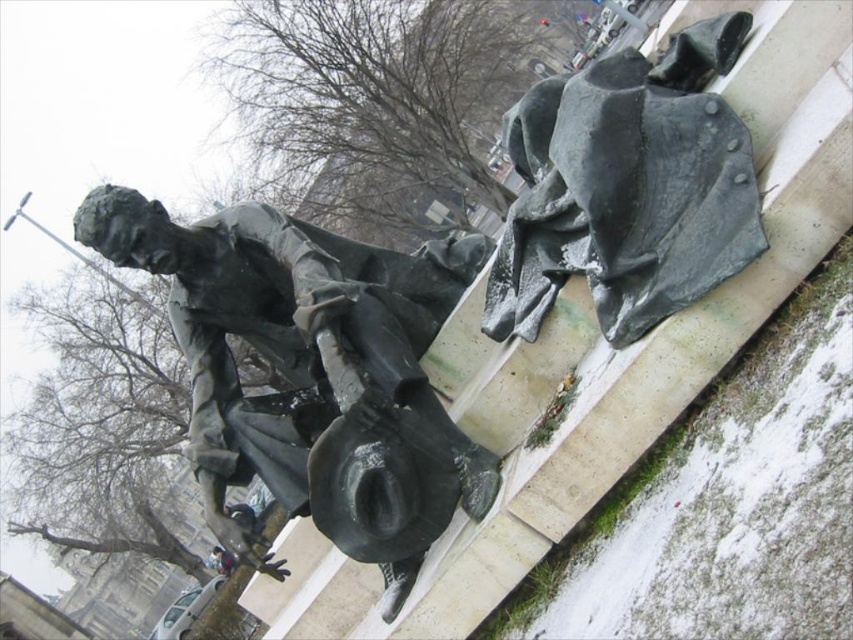
Based on the scene description, where is the bronze statue at center in relation to the rusty metal cape at upper right?

The bronze statue at center is to the left of the rusty metal cape at upper right.

You are standing at the point marked as point (370, 364) and want to walk towards the bronze statue. Can you pass through the space between the two figures?

The two figures are 22.89 feet apart, so yes, you can pass through the space between them as there is sufficient distance.

Consider the image. You are a city planner reviewing the layout of a public square. You notice the bronze statue at center and the rusty metal cape at upper right. Based on their positions, which object would cast a shadow over the other during midday in summer?

The bronze statue at center is below the rusty metal cape at upper right, so the rusty metal cape at upper right would cast a shadow over the bronze statue at center during midday in summer.